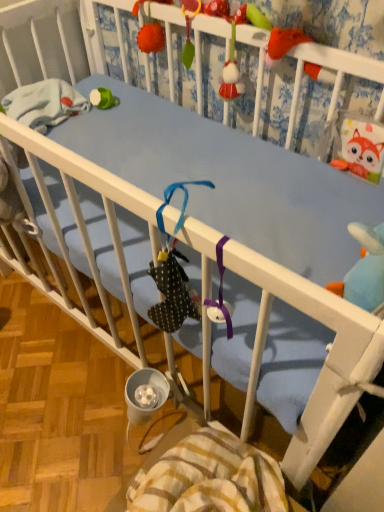
In order to face striped cotton blanket at lower center, should I rotate leftwards or rightwards?

Turn right approximately 1.160 degrees to face it.

This screenshot has width=384, height=512. Find the location of `striped cotton blanket at lower center`. striped cotton blanket at lower center is located at coordinates (210, 478).

Locate an element on the screen. fluffy orange pom-pom at upper center is located at coordinates (151, 38).

Is striped cotton blanket at lower center not near blue fabric crib at upper center?

They are positioned close to each other.

Is striped cotton blanket at lower center wider than blue fabric crib at upper center?

Yes.

In the image, is striped cotton blanket at lower center on the left side or the right side of blue fabric crib at upper center?

striped cotton blanket at lower center is to the left of blue fabric crib at upper center.

Could you measure the distance between striped cotton blanket at lower center and fluffy orange pom-pom at upper center?

striped cotton blanket at lower center is 3.45 feet from fluffy orange pom-pom at upper center.

Does striped cotton blanket at lower center touch fluffy orange pom-pom at upper center?

No, striped cotton blanket at lower center is not beside fluffy orange pom-pom at upper center.

From a real-world perspective, who is located higher, striped cotton blanket at lower center or fluffy orange pom-pom at upper center?

In real-world perspective, fluffy orange pom-pom at upper center is above.

Which is behind, fluffy orange pom-pom at upper center or blue fabric crib at upper center?

fluffy orange pom-pom at upper center is behind.

What's the angular difference between fluffy orange pom-pom at upper center and blue fabric crib at upper center's facing directions?

3.81 degrees separate the facing orientations of fluffy orange pom-pom at upper center and blue fabric crib at upper center.

Is fluffy orange pom-pom at upper center positioned with its back to blue fabric crib at upper center?

Yes, blue fabric crib at upper center is at the back of fluffy orange pom-pom at upper center.

From a real-world perspective, is fluffy orange pom-pom at upper center positioned above or below blue fabric crib at upper center?

fluffy orange pom-pom at upper center is situated higher than blue fabric crib at upper center in the real world.

Based on their sizes in the image, would you say blue fabric crib at upper center is bigger or smaller than striped cotton blanket at lower center?

In the image, blue fabric crib at upper center appears to be larger than striped cotton blanket at lower center.

From a real-world perspective, relative to striped cotton blanket at lower center, is blue fabric crib at upper center vertically above or below?

Clearly, from a real-world perspective, blue fabric crib at upper center is above striped cotton blanket at lower center.

From the image's perspective, is blue fabric crib at upper center located above striped cotton blanket at lower center?

Correct, blue fabric crib at upper center appears higher than striped cotton blanket at lower center in the image.

Does blue fabric crib at upper center touch fluffy orange pom-pom at upper center?

blue fabric crib at upper center and fluffy orange pom-pom at upper center are not in contact.

Is fluffy orange pom-pom at upper center surrounded by blue fabric crib at upper center?

No.

Is point (309, 95) positioned before point (136, 11)?

That is True.

From a real-world perspective, is blue fabric crib at upper center beneath fluffy orange pom-pom at upper center?

Indeed, from a real-world perspective, blue fabric crib at upper center is positioned beneath fluffy orange pom-pom at upper center.

Is there a large distance between fluffy orange pom-pom at upper center and striped cotton blanket at lower center?

fluffy orange pom-pom at upper center is far away from striped cotton blanket at lower center.

Between point (141, 37) and point (169, 477), which one is positioned behind?

The point (141, 37) is farther from the camera.

Is fluffy orange pom-pom at upper center bigger or smaller than striped cotton blanket at lower center?

fluffy orange pom-pom at upper center is smaller than striped cotton blanket at lower center.

The width and height of the screenshot is (384, 512). Find the location of `toy above the striped cotton blanket at lower center (from a real-world perspective)`. toy above the striped cotton blanket at lower center (from a real-world perspective) is located at coordinates (151, 38).

The height and width of the screenshot is (512, 384). I want to click on infant bed behind the striped cotton blanket at lower center, so click(x=315, y=97).

Identify the location of toy above the striped cotton blanket at lower center (from a real-world perspective). The image size is (384, 512). (151, 38).

Which object lies further to the anchor point fluffy orange pom-pom at upper center, striped cotton blanket at lower center or blue fabric crib at upper center?

striped cotton blanket at lower center is positioned further to the anchor fluffy orange pom-pom at upper center.

When comparing their distances from fluffy orange pom-pom at upper center, does blue fabric crib at upper center or striped cotton blanket at lower center seem further?

Based on the image, striped cotton blanket at lower center appears to be further to fluffy orange pom-pom at upper center.

Considering their positions, is fluffy orange pom-pom at upper center positioned closer to striped cotton blanket at lower center than blue fabric crib at upper center?

blue fabric crib at upper center is closer to striped cotton blanket at lower center.

Based on their spatial positions, is fluffy orange pom-pom at upper center or striped cotton blanket at lower center further from blue fabric crib at upper center?

The object further to blue fabric crib at upper center is striped cotton blanket at lower center.

Looking at this image, looking at the image, which one is located further to blue fabric crib at upper center, striped cotton blanket at lower center or fluffy orange pom-pom at upper center?

The object further to blue fabric crib at upper center is striped cotton blanket at lower center.

Which object lies further to the anchor point striped cotton blanket at lower center, blue fabric crib at upper center or fluffy orange pom-pom at upper center?

fluffy orange pom-pom at upper center is further to striped cotton blanket at lower center.

You are a GUI agent. You are given a task and a screenshot of the screen. Output one action in this format:
    pyautogui.click(x=<x>, y=<y>)
    Task: Click on the infant bed between fluffy orange pom-pom at upper center and striped cotton blanket at lower center vertically
    This screenshot has width=384, height=512.
    Given the screenshot: What is the action you would take?
    pyautogui.click(x=315, y=97)